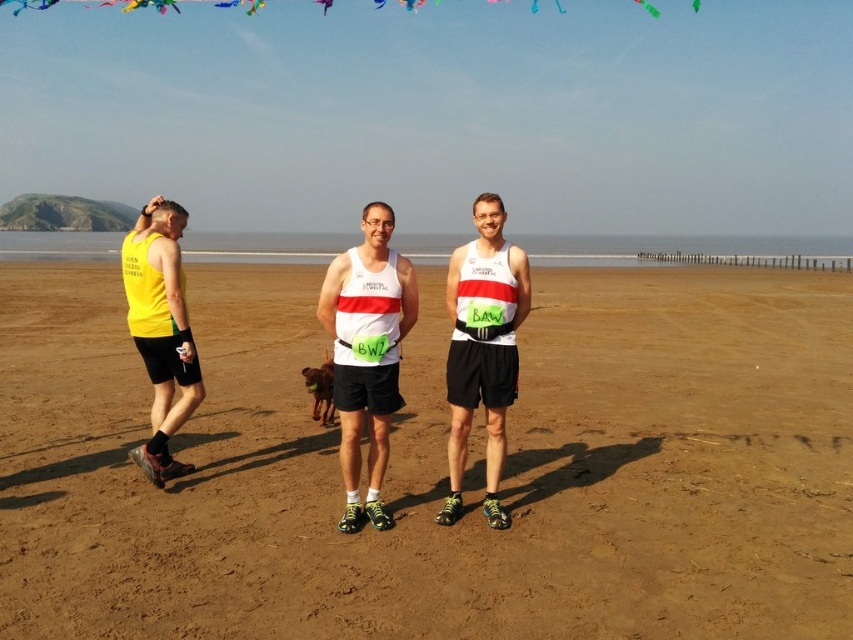
You are a photographer at the beach and want to capture both the white matte singlet at center and the matte black singlet at center in a single photo. Which one should you focus on first to ensure both are in the frame?

You should focus on the white matte singlet at center first because it is in front of the matte black singlet at center, so by focusing on the closer object, both will be in the frame.

You are a photographer trying to capture a photo of the brown sandy beach at center and the white matte singlet at center. Which object should you focus on first if you want to ensure both are in the frame without moving the camera?

The brown sandy beach at center is wider than the white matte singlet at center, so you should focus on the white matte singlet at center first to ensure it fits within the frame.